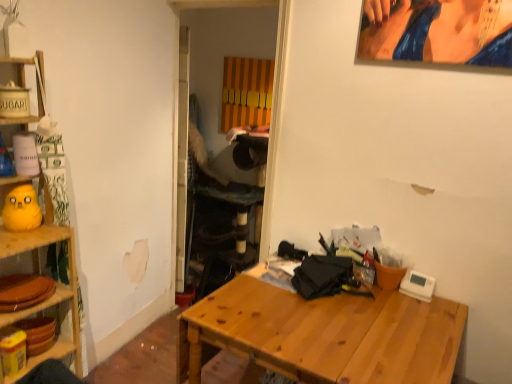
Question: From the image's perspective, is wooden table at center beneath yellow rubber duck at left?

Choices:
 (A) no
 (B) yes

Answer: (B)

Question: Is the depth of wooden table at center less than that of yellow rubber duck at left?

Choices:
 (A) yes
 (B) no

Answer: (A)

Question: Is wooden table at center completely or partially outside of yellow rubber duck at left?

Choices:
 (A) yes
 (B) no

Answer: (A)

Question: Does wooden table at center touch yellow rubber duck at left?

Choices:
 (A) no
 (B) yes

Answer: (A)

Question: Does wooden table at center appear on the right side of yellow rubber duck at left?

Choices:
 (A) no
 (B) yes

Answer: (B)

Question: Does wooden table at center have a greater width compared to yellow rubber duck at left?

Choices:
 (A) no
 (B) yes

Answer: (B)

Question: Is yellow rubber duck at left wider than wooden shelf at left?

Choices:
 (A) yes
 (B) no

Answer: (B)

Question: From the image's perspective, does yellow rubber duck at left appear lower than wooden shelf at left?

Choices:
 (A) no
 (B) yes

Answer: (A)

Question: Is yellow rubber duck at left thinner than wooden shelf at left?

Choices:
 (A) yes
 (B) no

Answer: (A)

Question: Is yellow rubber duck at left to the right of wooden shelf at left from the viewer's perspective?

Choices:
 (A) no
 (B) yes

Answer: (B)

Question: Does yellow rubber duck at left come behind wooden shelf at left?

Choices:
 (A) no
 (B) yes

Answer: (B)

Question: Are yellow rubber duck at left and wooden shelf at left making contact?

Choices:
 (A) no
 (B) yes

Answer: (A)

Question: Are wooden shelf at left and wooden table at center located far from each other?

Choices:
 (A) yes
 (B) no

Answer: (B)